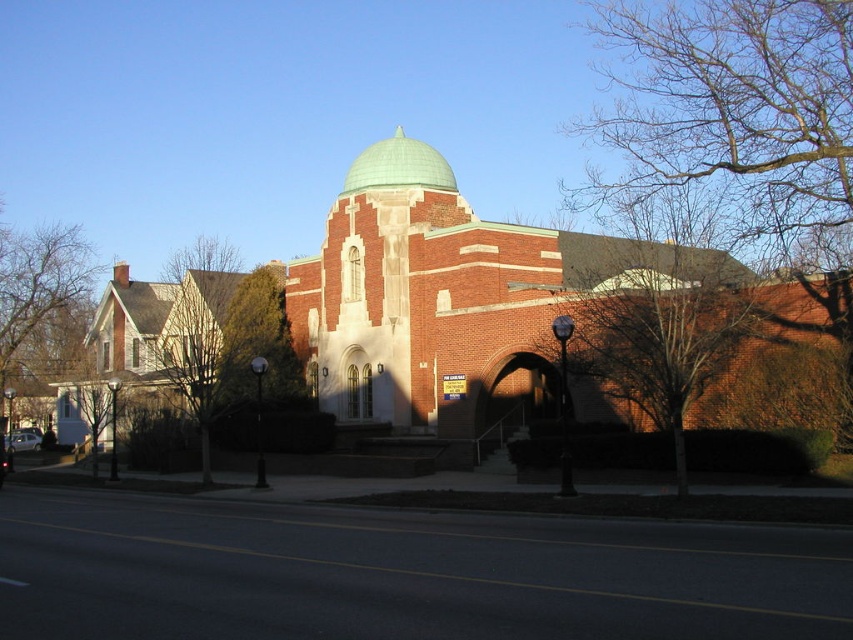
Question: Does bare branches at upper right have a larger size compared to brown leafless tree at left?

Choices:
 (A) yes
 (B) no

Answer: (A)

Question: Does bare branches at upper right have a smaller size compared to brown leafless tree at left?

Choices:
 (A) yes
 (B) no

Answer: (B)

Question: Among these points, which one is nearest to the camera?

Choices:
 (A) (45, 232)
 (B) (628, 60)

Answer: (A)

Question: Among these objects, which one is farthest from the camera?

Choices:
 (A) brown leafless tree at left
 (B) green matte dome at center

Answer: (A)

Question: Does bare branches at upper right come in front of brown leafless tree at left?

Choices:
 (A) yes
 (B) no

Answer: (A)

Question: Which object is the closest to the brown leafless tree at left?

Choices:
 (A) green matte dome at center
 (B) bare branches at upper right

Answer: (A)